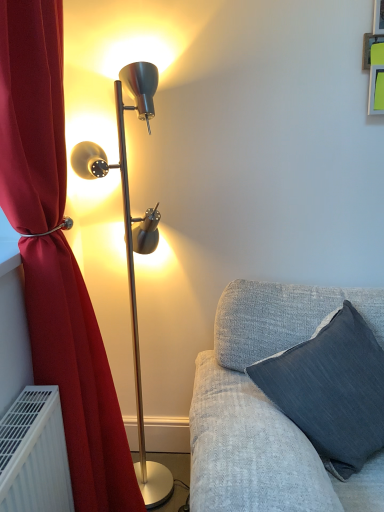
Question: Is velvet red curtain at left in front of dark gray fabric pillow at lower right?

Choices:
 (A) yes
 (B) no

Answer: (A)

Question: Is velvet red curtain at left outside dark gray fabric pillow at lower right?

Choices:
 (A) yes
 (B) no

Answer: (A)

Question: Considering the relative sizes of velvet red curtain at left and dark gray fabric pillow at lower right in the image provided, is velvet red curtain at left smaller than dark gray fabric pillow at lower right?

Choices:
 (A) yes
 (B) no

Answer: (B)

Question: From a real-world perspective, is velvet red curtain at left physically above dark gray fabric pillow at lower right?

Choices:
 (A) yes
 (B) no

Answer: (A)

Question: From the image's perspective, is velvet red curtain at left on dark gray fabric pillow at lower right?

Choices:
 (A) no
 (B) yes

Answer: (B)

Question: From the image's perspective, is metallic gold floor lamp at left located above or below velvet red curtain at left?

Choices:
 (A) above
 (B) below

Answer: (A)

Question: Is metallic gold floor lamp at left wider or thinner than velvet red curtain at left?

Choices:
 (A) wide
 (B) thin

Answer: (B)

Question: Is metallic gold floor lamp at left in front of or behind velvet red curtain at left in the image?

Choices:
 (A) behind
 (B) front

Answer: (A)

Question: Considering the positions of metallic gold floor lamp at left and velvet red curtain at left in the image, is metallic gold floor lamp at left taller or shorter than velvet red curtain at left?

Choices:
 (A) tall
 (B) short

Answer: (B)

Question: From a real-world perspective, is dark gray fabric pillow at lower right positioned above or below velvet red curtain at left?

Choices:
 (A) below
 (B) above

Answer: (A)

Question: Looking at the image, does dark gray fabric pillow at lower right seem bigger or smaller compared to velvet red curtain at left?

Choices:
 (A) small
 (B) big

Answer: (A)

Question: Is dark gray fabric pillow at lower right to the left or to the right of velvet red curtain at left in the image?

Choices:
 (A) left
 (B) right

Answer: (B)

Question: Considering the positions of dark gray fabric pillow at lower right and velvet red curtain at left in the image, is dark gray fabric pillow at lower right wider or thinner than velvet red curtain at left?

Choices:
 (A) wide
 (B) thin

Answer: (A)

Question: Considering the positions of velvet red curtain at left and dark gray fabric pillow at lower right in the image, is velvet red curtain at left wider or thinner than dark gray fabric pillow at lower right?

Choices:
 (A) thin
 (B) wide

Answer: (A)

Question: From a real-world perspective, relative to dark gray fabric pillow at lower right, is velvet red curtain at left vertically above or below?

Choices:
 (A) above
 (B) below

Answer: (A)